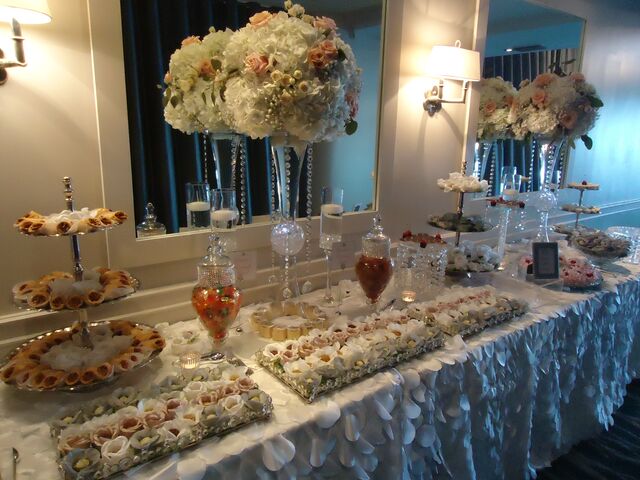
What are the coordinates of `tiers of tiered serving tray` in the screenshot? It's located at (82, 212), (88, 282), (98, 346), (461, 182), (470, 221), (472, 267), (586, 185), (582, 208), (571, 229).